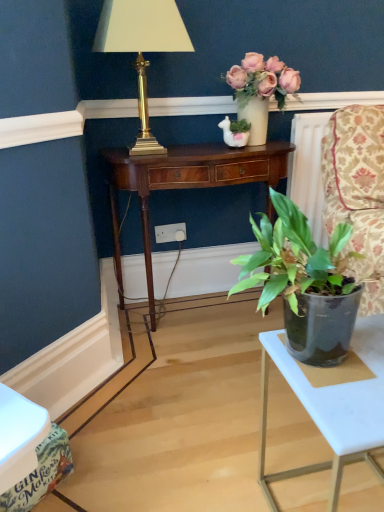
Question: Is mahogany wood desk at center oriented towards white plastic power outlet at center?

Choices:
 (A) yes
 (B) no

Answer: (A)

Question: Is mahogany wood desk at center smaller than white plastic power outlet at center?

Choices:
 (A) yes
 (B) no

Answer: (B)

Question: Can you confirm if mahogany wood desk at center is positioned to the left of white plastic power outlet at center?

Choices:
 (A) no
 (B) yes

Answer: (A)

Question: From the image's perspective, would you say mahogany wood desk at center is positioned over white plastic power outlet at center?

Choices:
 (A) no
 (B) yes

Answer: (A)

Question: From a real-world perspective, is mahogany wood desk at center under white plastic power outlet at center?

Choices:
 (A) no
 (B) yes

Answer: (A)

Question: Considering the positions of white plastic table at lower right and white plastic power outlet at center in the image, is white plastic table at lower right wider or thinner than white plastic power outlet at center?

Choices:
 (A) thin
 (B) wide

Answer: (B)

Question: Considering the positions of white plastic table at lower right and white plastic power outlet at center in the image, is white plastic table at lower right taller or shorter than white plastic power outlet at center?

Choices:
 (A) short
 (B) tall

Answer: (B)

Question: From a real-world perspective, is white plastic table at lower right positioned above or below white plastic power outlet at center?

Choices:
 (A) below
 (B) above

Answer: (A)

Question: Considering the positions of point (264, 406) and point (173, 241), is point (264, 406) closer or farther from the camera than point (173, 241)?

Choices:
 (A) closer
 (B) farther

Answer: (A)

Question: Visually, is mahogany wood desk at center positioned to the left or to the right of white plastic table at lower right?

Choices:
 (A) left
 (B) right

Answer: (A)

Question: Considering the positions of point (200, 157) and point (324, 429), is point (200, 157) closer or farther from the camera than point (324, 429)?

Choices:
 (A) farther
 (B) closer

Answer: (A)

Question: Considering the positions of mahogany wood desk at center and white plastic table at lower right in the image, is mahogany wood desk at center taller or shorter than white plastic table at lower right?

Choices:
 (A) short
 (B) tall

Answer: (B)

Question: From a real-world perspective, is mahogany wood desk at center positioned above or below white plastic table at lower right?

Choices:
 (A) below
 (B) above

Answer: (B)

Question: From the image's perspective, is mahogany wood desk at center positioned above or below green glossy plant at center, the 2th houseplant when ordered from top to bottom?

Choices:
 (A) below
 (B) above

Answer: (B)

Question: From a real-world perspective, is mahogany wood desk at center above or below green glossy plant at center, acting as the first houseplant starting from the front?

Choices:
 (A) above
 (B) below

Answer: (B)